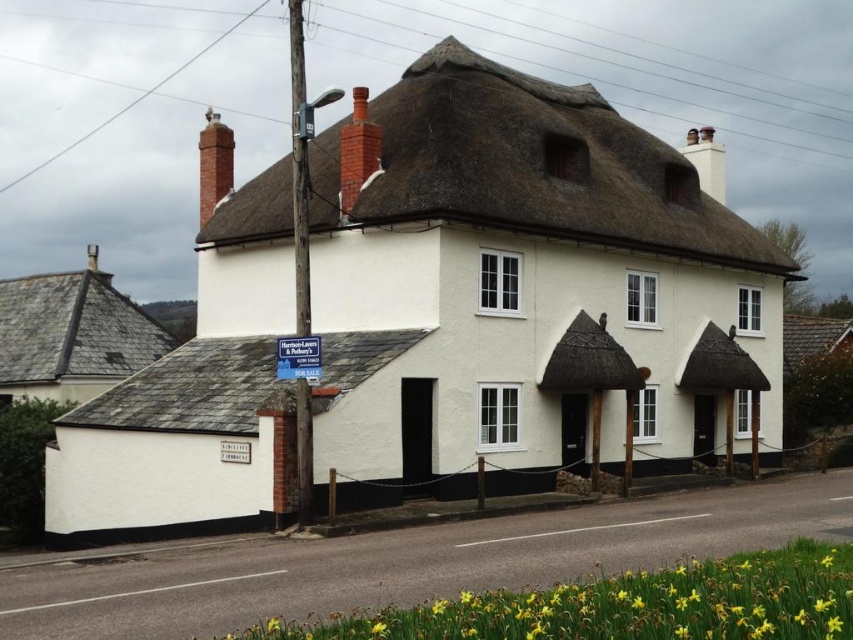
Can you confirm if white thatched roof cottage at center is positioned below thatched roof at upper center?

Correct, white thatched roof cottage at center is located below thatched roof at upper center.

Measure the distance between white thatched roof cottage at center and camera.

white thatched roof cottage at center is 24.16 meters from camera.

Describe the element at coordinates (529, 291) in the screenshot. I see `white thatched roof cottage at center` at that location.

Locate an element on the screen. white thatched roof cottage at center is located at coordinates (529, 291).

Measure the distance between white thatched roof cottage at center and gray slate roof at upper left.

white thatched roof cottage at center is 17.98 meters away from gray slate roof at upper left.

Does white thatched roof cottage at center have a larger size compared to gray slate roof at upper left?

Yes, white thatched roof cottage at center is bigger than gray slate roof at upper left.

Who is more distant from viewer, (x=247, y=360) or (x=1, y=337)?

Point (x=1, y=337)

Where is `white thatched roof cottage at center`? This screenshot has height=640, width=853. white thatched roof cottage at center is located at coordinates (529, 291).

Between thatched roof at upper center and red brick chimney at upper left, which one appears on the left side from the viewer's perspective?

From the viewer's perspective, red brick chimney at upper left appears more on the left side.

Between point (248, 230) and point (202, 189), which one is positioned in front?

Point (248, 230)

I want to click on thatched roof at upper center, so click(x=527, y=166).